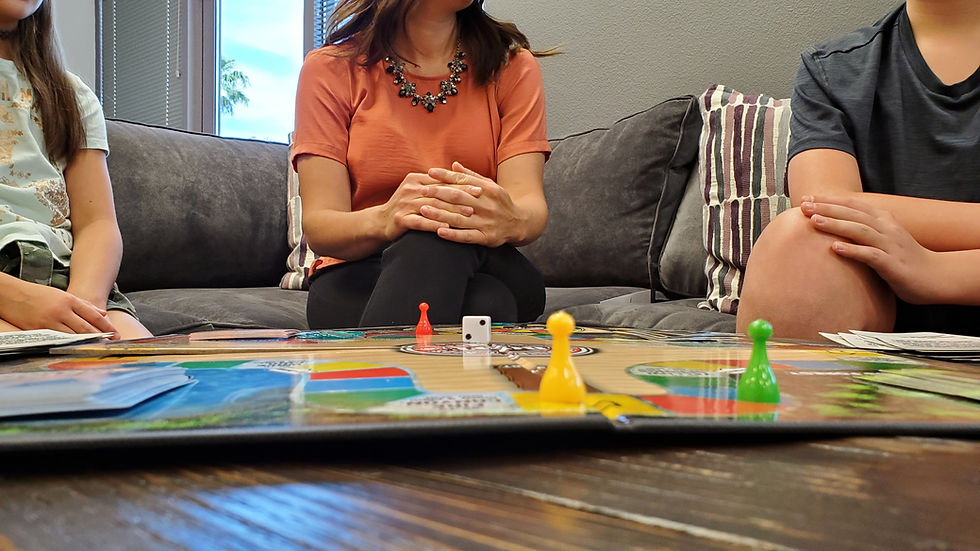
The width and height of the screenshot is (980, 551). In order to click on game board in this screenshot , I will do coord(305,390).